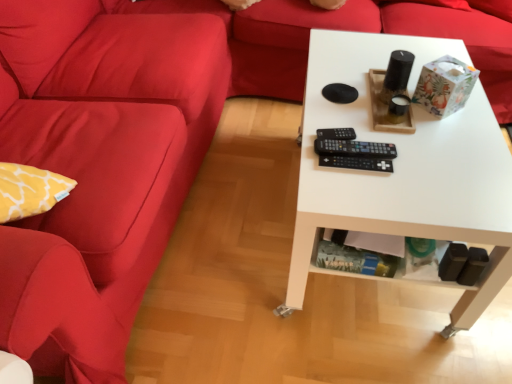
Question: Is the depth of black plastic remote at center, positioned as the second control in bottom-to-top order, greater than that of black plastic remote at center, the 1th control when ordered from bottom to top?

Choices:
 (A) no
 (B) yes

Answer: (B)

Question: Does black plastic remote at center, positioned as the second control in bottom-to-top order, have a greater height compared to black plastic remote at center, which is counted as the third control, starting from the top?

Choices:
 (A) no
 (B) yes

Answer: (B)

Question: Is black plastic remote at center, positioned as the second control in bottom-to-top order, positioned with its back to black plastic remote at center, the 1th control when ordered from bottom to top?

Choices:
 (A) no
 (B) yes

Answer: (A)

Question: From a real-world perspective, does black plastic remote at center, positioned as the second control in bottom-to-top order, stand above black plastic remote at center, the 1th control when ordered from bottom to top?

Choices:
 (A) yes
 (B) no

Answer: (A)

Question: From a real-world perspective, is black plastic remote at center, arranged as the second control when viewed from the top, positioned under black plastic remote at center, which is counted as the third control, starting from the top, based on gravity?

Choices:
 (A) no
 (B) yes

Answer: (A)

Question: Visually, is black plastic remote at center, acting as the 1th control starting from the top, positioned to the left or to the right of black plastic remote at center, which is counted as the third control, starting from the top?

Choices:
 (A) right
 (B) left

Answer: (B)

Question: In terms of height, does black plastic remote at center, acting as the 1th control starting from the top, look taller or shorter compared to black plastic remote at center, the 1th control when ordered from bottom to top?

Choices:
 (A) short
 (B) tall

Answer: (B)

Question: From the image's perspective, is black plastic remote at center, the 3th control in the bottom-to-top sequence, positioned above or below black plastic remote at center, the 1th control when ordered from bottom to top?

Choices:
 (A) below
 (B) above

Answer: (B)

Question: From a real-world perspective, is black plastic remote at center, acting as the 1th control starting from the top, positioned above or below black plastic remote at center, the 1th control when ordered from bottom to top?

Choices:
 (A) below
 (B) above

Answer: (B)

Question: From a real-world perspective, is black plastic remote at center, the 1th control when ordered from bottom to top, physically located above or below white matte table at center?

Choices:
 (A) above
 (B) below

Answer: (A)

Question: Considering the positions of black plastic remote at center, which is counted as the third control, starting from the top, and white matte table at center in the image, is black plastic remote at center, which is counted as the third control, starting from the top, wider or thinner than white matte table at center?

Choices:
 (A) thin
 (B) wide

Answer: (A)

Question: From the image's perspective, is black plastic remote at center, which is counted as the third control, starting from the top, above or below white matte table at center?

Choices:
 (A) above
 (B) below

Answer: (B)

Question: Visually, is black plastic remote at center, which is counted as the third control, starting from the top, positioned to the left or to the right of white matte table at center?

Choices:
 (A) left
 (B) right

Answer: (A)

Question: Considering the positions of matte red couch at left and black plastic remote at center, the 3th control in the bottom-to-top sequence, in the image, is matte red couch at left taller or shorter than black plastic remote at center, the 3th control in the bottom-to-top sequence,?

Choices:
 (A) tall
 (B) short

Answer: (A)

Question: Does point (180, 140) appear closer or farther from the camera than point (347, 130)?

Choices:
 (A) closer
 (B) farther

Answer: (B)